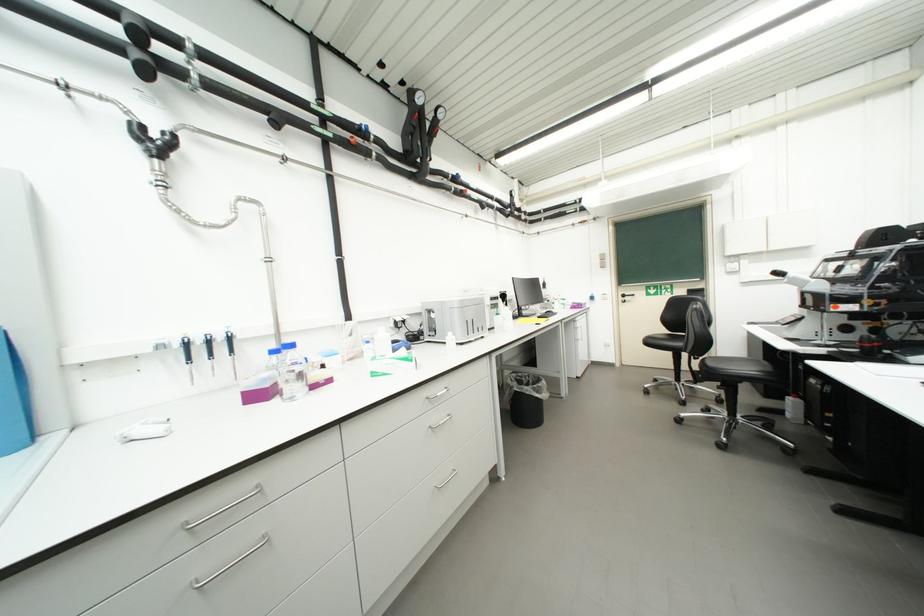
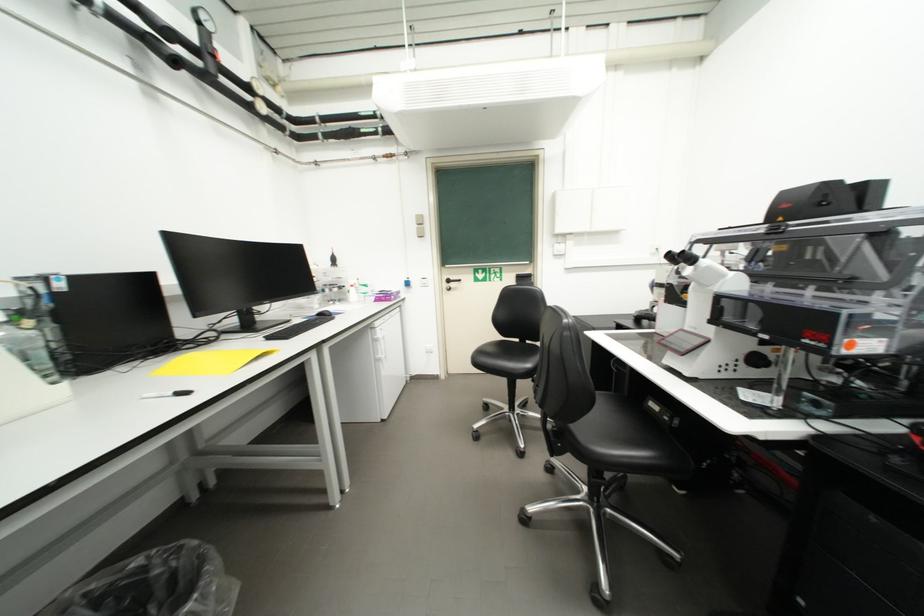
The point at (723, 269) is marked in the first image. Where is the corresponding point in the second image?

(553, 249)